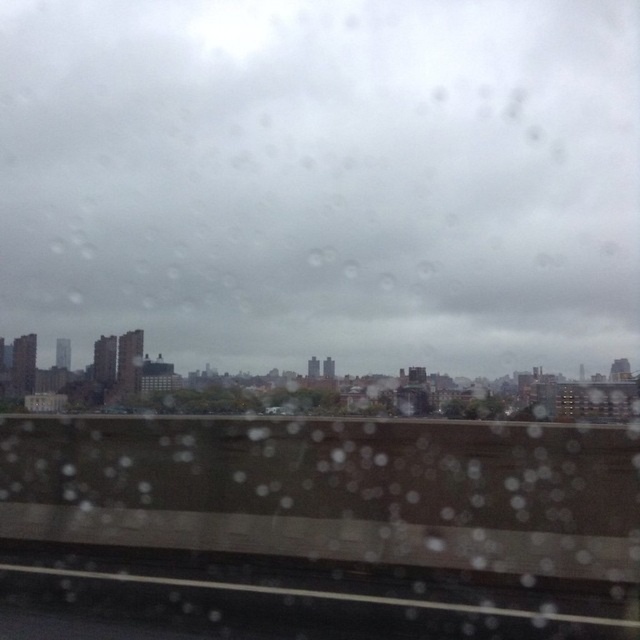
You are inside a train carriage and looking through the window. You notice a transparent glass at upper center and a black rubber train track at lower center. Which object is positioned to the right side of the other?

The transparent glass at upper center is positioned to the right of the black rubber train track at lower center.